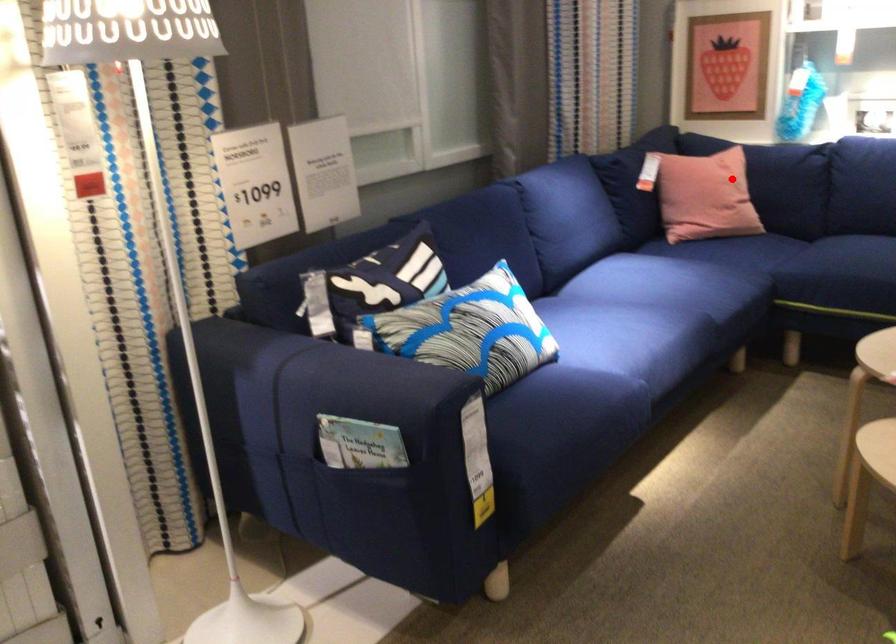
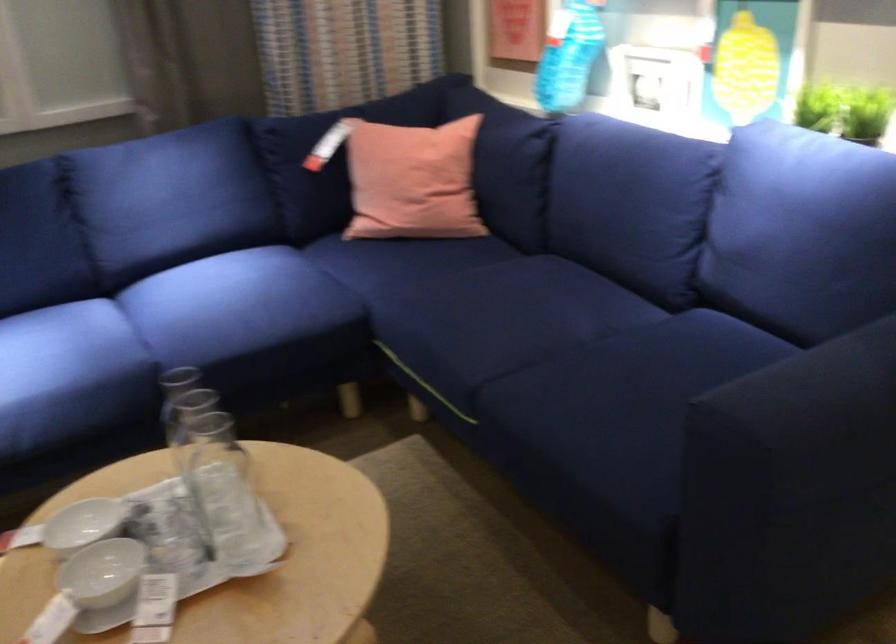
Question: I am providing you with two images of the same scene from different viewpoints. A red point is shown in image1. For the corresponding object point in image2, is it positioned nearer or farther from the camera?

Choices:
 (A) Nearer
 (B) Farther

Answer: (A)